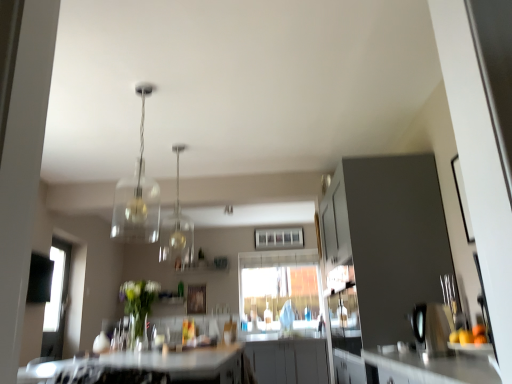
This screenshot has height=384, width=512. Identify the location of clear glass pendant light at center, the 1th light fixture viewed from the back. (177, 229).

Identify the location of clear glass pendant light at upper center, marked as the 2th light fixture in a back-to-front arrangement. (137, 195).

How much space does transparent glass window at center, which appears as the 1th window when ordered from the bottom, occupy horizontally?

3.65 inches.

Describe the element at coordinates (432, 328) in the screenshot. I see `wooden cutting board at right` at that location.

You are a GUI agent. You are given a task and a screenshot of the screen. Output one action in this format:
    pyautogui.click(x=<x>, y=<y>)
    Task: Click on the clear glass window at center, the 1th window positioned from the top
    
    Given the screenshot: What is the action you would take?
    pyautogui.click(x=278, y=238)

What are the coordinates of `clear glass pendant light at center, which is counted as the 2th light fixture, starting from the front` in the screenshot? It's located at (177, 229).

From a real-world perspective, who is located lower, wooden cutting board at right or clear glass pendant light at center, which is counted as the 2th light fixture, starting from the front?

wooden cutting board at right, from a real-world perspective.

From the picture: From the image's perspective, which is above, wooden cutting board at right or clear glass pendant light at center, the 1th light fixture viewed from the back?

clear glass pendant light at center, the 1th light fixture viewed from the back, appears higher in the image.

Is wooden cutting board at right not within clear glass pendant light at center, which is counted as the 2th light fixture, starting from the front?

Yes, wooden cutting board at right is not within clear glass pendant light at center, which is counted as the 2th light fixture, starting from the front.

Does wooden cutting board at right turn towards clear glass pendant light at center, which is counted as the 2th light fixture, starting from the front?

No, wooden cutting board at right does not turn towards clear glass pendant light at center, which is counted as the 2th light fixture, starting from the front.

Which is closer to the camera, (x=193, y=234) or (x=25, y=380)?

The point (x=25, y=380) is closer.

In the scene shown: Is white glossy countertop at lower center at the back of clear glass pendant light at center, which is counted as the 2th light fixture, starting from the front?

No, clear glass pendant light at center, which is counted as the 2th light fixture, starting from the front, is not facing the opposite direction of white glossy countertop at lower center.

From a real-world perspective, is clear glass pendant light at center, the 1th light fixture viewed from the back, physically located above or below white glossy countertop at lower center?

Clearly, from a real-world perspective, clear glass pendant light at center, the 1th light fixture viewed from the back, is above white glossy countertop at lower center.

Looking at this image, does white glossy countertop at lower center appear on the right side of transparent glass window at center, the 2th window in the top-to-bottom sequence?

No.

Would you consider white glossy countertop at lower center to be distant from transparent glass window at center, the 2th window in the top-to-bottom sequence?

Yes, white glossy countertop at lower center and transparent glass window at center, the 2th window in the top-to-bottom sequence, are located far from each other.

From a real-world perspective, is white glossy countertop at lower center located beneath transparent glass window at center, which appears as the 1th window when ordered from the bottom?

Yes, from a real-world perspective, white glossy countertop at lower center is beneath transparent glass window at center, which appears as the 1th window when ordered from the bottom.

Is clear glass window at center, the 1th window positioned from the top, wider or thinner than clear glass pendant light at center, the 1th light fixture viewed from the back?

Clearly, clear glass window at center, the 1th window positioned from the top, has less width compared to clear glass pendant light at center, the 1th light fixture viewed from the back.

Considering the sizes of objects clear glass window at center, positioned as the 2th window in bottom-to-top order, and clear glass pendant light at center, the 1th light fixture viewed from the back, in the image provided, who is bigger, clear glass window at center, positioned as the 2th window in bottom-to-top order, or clear glass pendant light at center, the 1th light fixture viewed from the back,?

clear glass pendant light at center, the 1th light fixture viewed from the back.

Considering the relative positions of clear glass window at center, the 1th window positioned from the top, and clear glass pendant light at center, the 1th light fixture viewed from the back, in the image provided, is clear glass window at center, the 1th window positioned from the top, to the right of clear glass pendant light at center, the 1th light fixture viewed from the back, from the viewer's perspective?

Indeed, clear glass window at center, the 1th window positioned from the top, is positioned on the right side of clear glass pendant light at center, the 1th light fixture viewed from the back.

The image size is (512, 384). Find the location of `light fixture that is the 1st object directly below the clear glass window at center, positioned as the 2th window in bottom-to-top order (from a real-world perspective)`. light fixture that is the 1st object directly below the clear glass window at center, positioned as the 2th window in bottom-to-top order (from a real-world perspective) is located at coordinates (177, 229).

From a real-world perspective, count 1st light fixtures upward from the white glossy countertop at lower center and point to it. Please provide its 2D coordinates.

[(137, 195)]

Is white glossy countertop at lower center facing towards clear glass pendant light at upper center, positioned as the first light fixture in front-to-back order?

No, white glossy countertop at lower center is not turned towards clear glass pendant light at upper center, positioned as the first light fixture in front-to-back order.

Considering the positions of objects clear glass window at center, the 1th window positioned from the top, and clear glass pendant light at upper center, positioned as the first light fixture in front-to-back order, in the image provided, who is in front, clear glass window at center, the 1th window positioned from the top, or clear glass pendant light at upper center, positioned as the first light fixture in front-to-back order,?

clear glass pendant light at upper center, positioned as the first light fixture in front-to-back order, is more forward.

Is clear glass window at center, the 1th window positioned from the top, wider or thinner than clear glass pendant light at upper center, marked as the 2th light fixture in a back-to-front arrangement?

clear glass window at center, the 1th window positioned from the top, is thinner than clear glass pendant light at upper center, marked as the 2th light fixture in a back-to-front arrangement.

Is clear glass window at center, the 1th window positioned from the top, aimed at clear glass pendant light at upper center, positioned as the first light fixture in front-to-back order?

Yes, clear glass window at center, the 1th window positioned from the top, is aimed at clear glass pendant light at upper center, positioned as the first light fixture in front-to-back order.

Is point (189, 228) positioned after point (144, 98)?

Yes, point (189, 228) is behind point (144, 98).

From the picture: Are clear glass pendant light at center, which is counted as the 2th light fixture, starting from the front, and clear glass pendant light at upper center, positioned as the first light fixture in front-to-back order, making contact?

There is a gap between clear glass pendant light at center, which is counted as the 2th light fixture, starting from the front, and clear glass pendant light at upper center, positioned as the first light fixture in front-to-back order.

Considering the sizes of clear glass pendant light at center, the 1th light fixture viewed from the back, and clear glass pendant light at upper center, marked as the 2th light fixture in a back-to-front arrangement, in the image, is clear glass pendant light at center, the 1th light fixture viewed from the back, wider or thinner than clear glass pendant light at upper center, marked as the 2th light fixture in a back-to-front arrangement,?

Considering their sizes, clear glass pendant light at center, the 1th light fixture viewed from the back, looks slimmer than clear glass pendant light at upper center, marked as the 2th light fixture in a back-to-front arrangement.

Can you confirm if clear glass pendant light at center, the 1th light fixture viewed from the back, is positioned to the right of clear glass pendant light at upper center, positioned as the first light fixture in front-to-back order?

Correct, you'll find clear glass pendant light at center, the 1th light fixture viewed from the back, to the right of clear glass pendant light at upper center, positioned as the first light fixture in front-to-back order.

From a real-world perspective, which light fixture is the 2nd one above the wooden cutting board at right? Please provide its 2D coordinates.

[(177, 229)]

Identify the location of countertop that is on the right side of clear glass pendant light at center, which is counted as the 2th light fixture, starting from the front. The height and width of the screenshot is (384, 512). (145, 368).

Estimate the real-world distances between objects in this image. Which object is further from transparent glass window at center, which appears as the 1th window when ordered from the bottom, clear glass pendant light at upper center, positioned as the first light fixture in front-to-back order, or matte gray cabinet at right?

matte gray cabinet at right is further to transparent glass window at center, which appears as the 1th window when ordered from the bottom.

Which object lies nearer to the anchor point matte gray cabinet at right, clear glass window at center, the 1th window positioned from the top, or transparent glass window at center, which appears as the 1th window when ordered from the bottom?

transparent glass window at center, which appears as the 1th window when ordered from the bottom, is positioned closer to the anchor matte gray cabinet at right.

Which object lies further to the anchor point clear glass pendant light at center, which is counted as the 2th light fixture, starting from the front, white glossy countertop at lower center or wooden cutting board at right?

wooden cutting board at right lies further to clear glass pendant light at center, which is counted as the 2th light fixture, starting from the front, than the other object.

Looking at the image, which one is located further to clear glass pendant light at upper center, marked as the 2th light fixture in a back-to-front arrangement, transparent glass window at center, the 2th window in the top-to-bottom sequence, or white glossy countertop at lower center?

transparent glass window at center, the 2th window in the top-to-bottom sequence.

Estimate the real-world distances between objects in this image. Which object is further from white glossy countertop at lower center, wooden cutting board at right or clear glass window at center, the 1th window positioned from the top?

The object further to white glossy countertop at lower center is clear glass window at center, the 1th window positioned from the top.

Based on their spatial positions, is transparent glass window at center, the 2th window in the top-to-bottom sequence, or matte gray cabinet at right closer to clear glass pendant light at upper center, positioned as the first light fixture in front-to-back order?

The object closer to clear glass pendant light at upper center, positioned as the first light fixture in front-to-back order, is matte gray cabinet at right.

From the image, which object appears to be farther from clear glass pendant light at center, the 1th light fixture viewed from the back, wooden cutting board at right or clear glass pendant light at upper center, marked as the 2th light fixture in a back-to-front arrangement?

Among the two, wooden cutting board at right is located further to clear glass pendant light at center, the 1th light fixture viewed from the back.

Considering their positions, is wooden cutting board at right positioned closer to white glossy countertop at lower center than transparent glass window at center, which appears as the 1th window when ordered from the bottom?

Based on the image, wooden cutting board at right appears to be nearer to white glossy countertop at lower center.

Where is `cabinetry between clear glass pendant light at upper center, marked as the 2th light fixture in a back-to-front arrangement, and transparent glass window at center, the 2th window in the top-to-bottom sequence, along the z-axis`? This screenshot has width=512, height=384. cabinetry between clear glass pendant light at upper center, marked as the 2th light fixture in a back-to-front arrangement, and transparent glass window at center, the 2th window in the top-to-bottom sequence, along the z-axis is located at coordinates (387, 239).

Identify the location of countertop between clear glass pendant light at upper center, positioned as the first light fixture in front-to-back order, and wooden cutting board at right from left to right. (145, 368).

Where is `cabinetry between wooden cutting board at right and transparent glass window at center, the 2th window in the top-to-bottom sequence, from front to back`? The image size is (512, 384). cabinetry between wooden cutting board at right and transparent glass window at center, the 2th window in the top-to-bottom sequence, from front to back is located at coordinates (387, 239).

Where is `window located between clear glass pendant light at upper center, positioned as the first light fixture in front-to-back order, and clear glass window at center, positioned as the 2th window in bottom-to-top order, in the depth direction`? The width and height of the screenshot is (512, 384). window located between clear glass pendant light at upper center, positioned as the first light fixture in front-to-back order, and clear glass window at center, positioned as the 2th window in bottom-to-top order, in the depth direction is located at coordinates (280, 290).